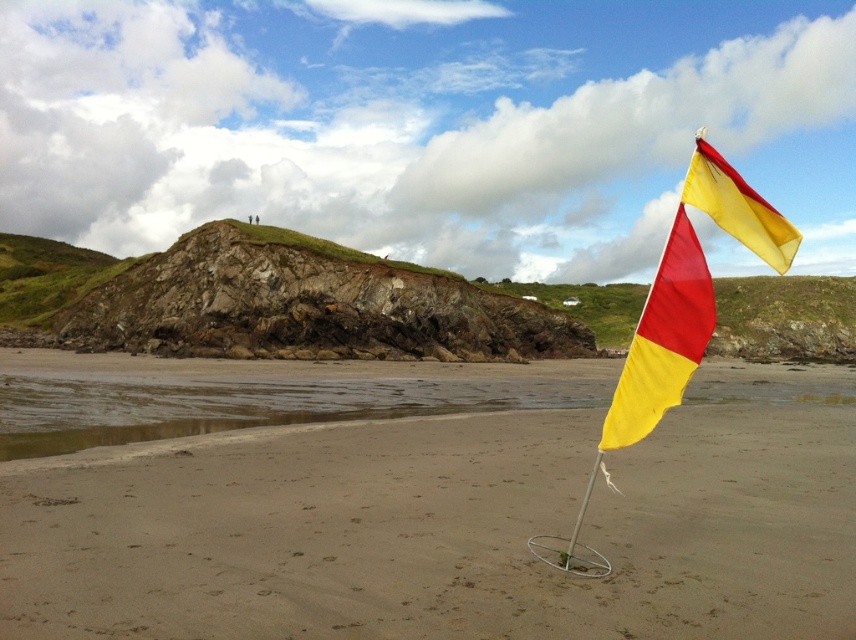
You are a photographer trying to capture both the yellow fabric flag at center and the yellow fabric flag at right in a single shot. Which flag should you focus on first to ensure both are in clear view?

You should focus on the yellow fabric flag at center first because it is closer to the viewer, ensuring that both it and the yellow fabric flag at right will be in clear view.

You are a beachgoer who wants to ensure you are within the safe swimming zone. The flags indicate different areas. Which flag, the yellow fabric flag at center or the yellow fabric flag at right, is more likely to mark the safer swimming area based on their sizes?

The yellow fabric flag at right is larger than the yellow fabric flag at center, so it is more likely to mark the safer swimming area as larger flags are typically used to indicate primary or safer zones.

You are a photographer trying to capture both the yellow fabric flag at center and the yellow fabric flag at right in a single shot. Based on their sizes, which flag should you focus on to ensure both are visible clearly in your photo?

The yellow fabric flag at center might be wider than yellow fabric flag at right, so focusing on the wider flag at center would help ensure both are visible clearly in the photo.